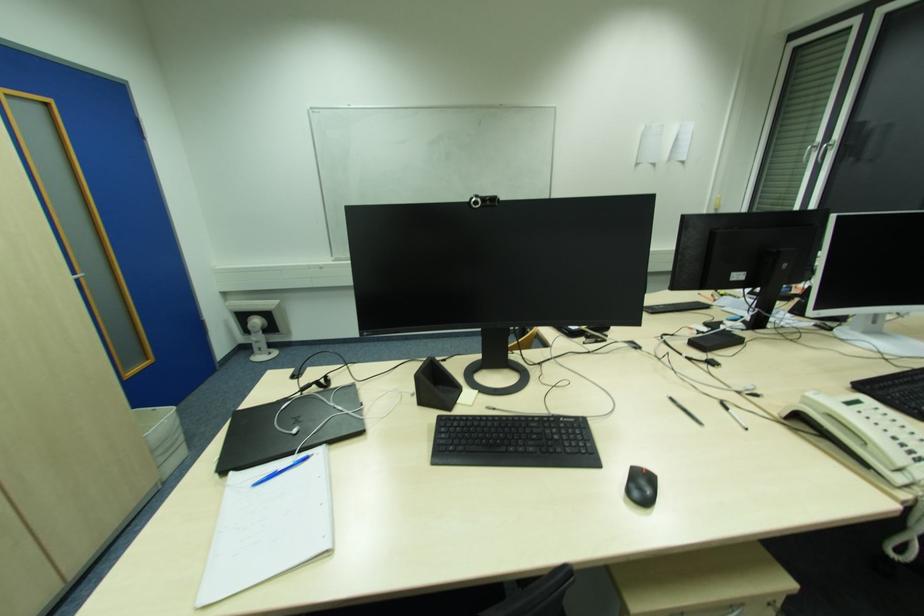
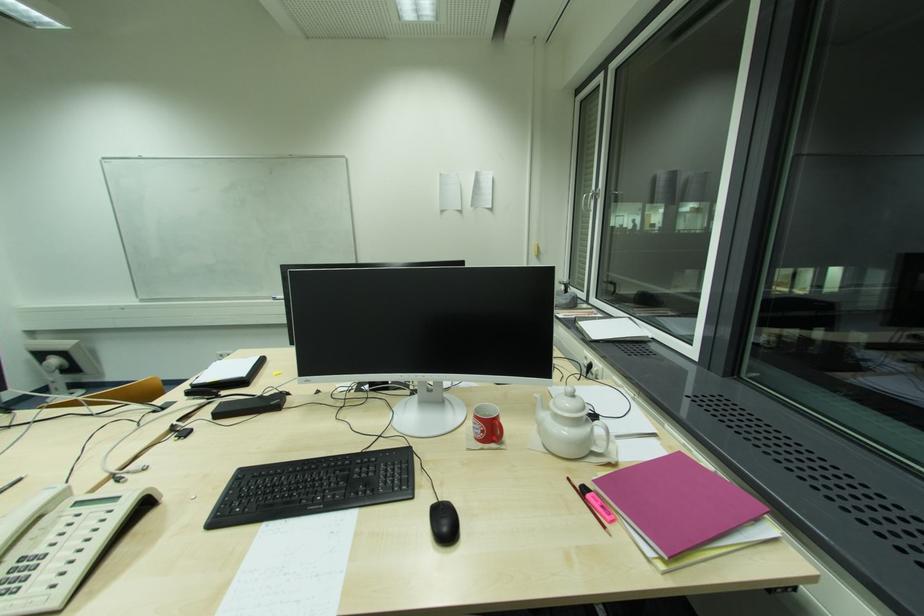
Question: What movement of the cameraman would produce the second image?

Choices:
 (A) Left
 (B) Right
 (C) Forward
 (D) Backward

Answer: (B)